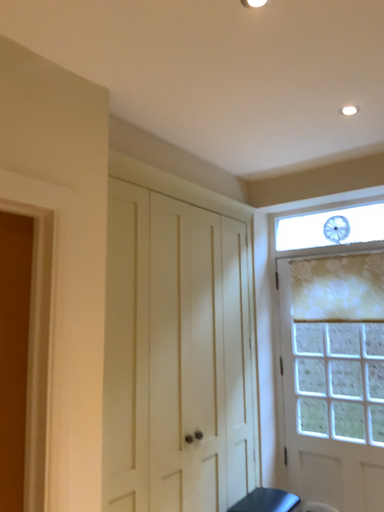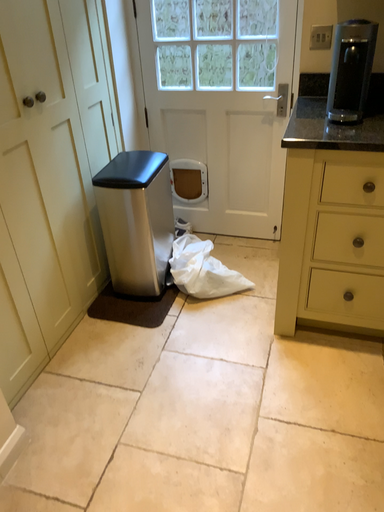
Question: Which way did the camera rotate in the video?

Choices:
 (A) rotated left
 (B) rotated right

Answer: (B)